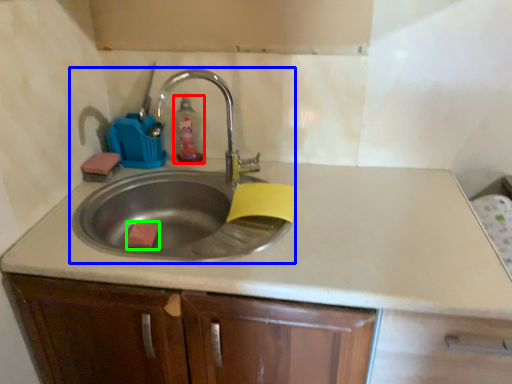
Question: Estimate the real-world distances between objects in this image. Which object is closer to soap dispenser (highlighted by a red box), sink (highlighted by a blue box) or soap (highlighted by a green box)?

Choices:
 (A) sink
 (B) soap

Answer: (A)